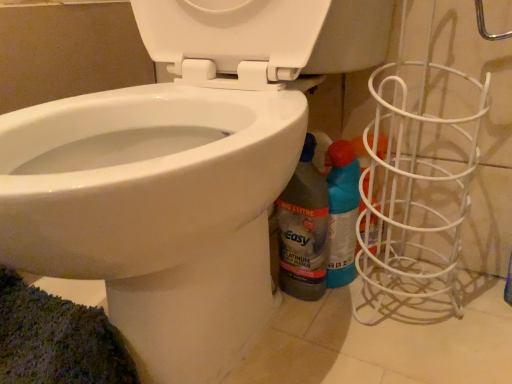
Question: From the image's perspective, is white glossy bidet at lower left positioned above or below translucent plastic bottle at lower right, the second cleaning product in the right-to-left sequence?

Choices:
 (A) below
 (B) above

Answer: (B)

Question: Which is correct: white glossy bidet at lower left is inside translucent plastic bottle at lower right, the second cleaning product in the right-to-left sequence, or outside of it?

Choices:
 (A) outside
 (B) inside

Answer: (A)

Question: Which object is the closest to the translucent plastic bottle at lower right, the first cleaning product in the left-to-right sequence?

Choices:
 (A) blue glossy spray can at lower right, which appears as the 1th cleaning product when viewed from the right
 (B) white glossy bidet at lower left

Answer: (A)

Question: Estimate the real-world distances between objects in this image. Which object is closer to the white glossy bidet at lower left?

Choices:
 (A) blue glossy spray can at lower right, which appears as the 1th cleaning product when viewed from the right
 (B) translucent plastic bottle at lower right, the first cleaning product in the left-to-right sequence

Answer: (B)